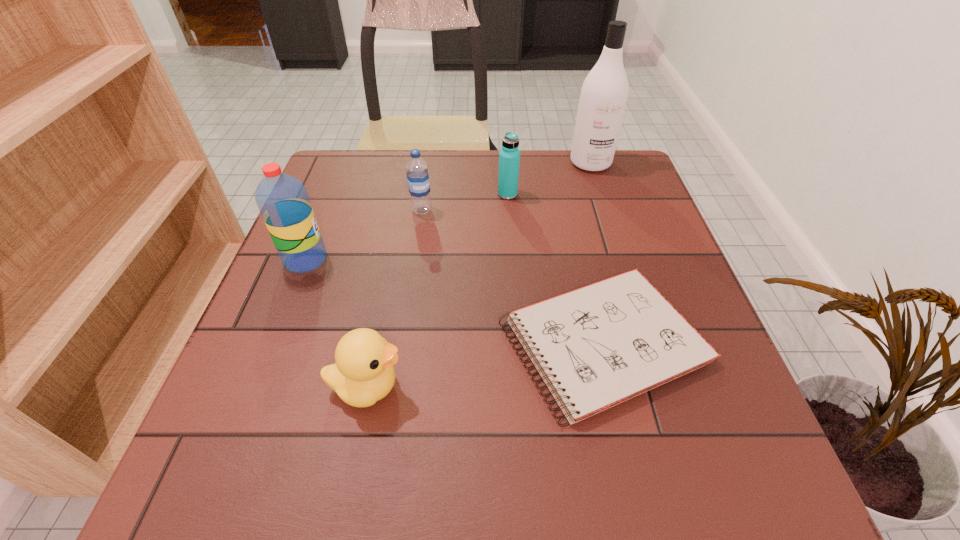
Image resolution: width=960 pixels, height=540 pixels. I want to click on vacant space that satisfies the following two spatial constraints: 1. on the front-facing side of the tallest object; 2. on the front label of the leftmost water bottle, so click(622, 260).

Identify the location of blank area in the image that satisfies the following two spatial constraints: 1. on the label of the second water bottle from right to left; 2. on the face of the fifth tallest object. The height and width of the screenshot is (540, 960). coord(396,387).